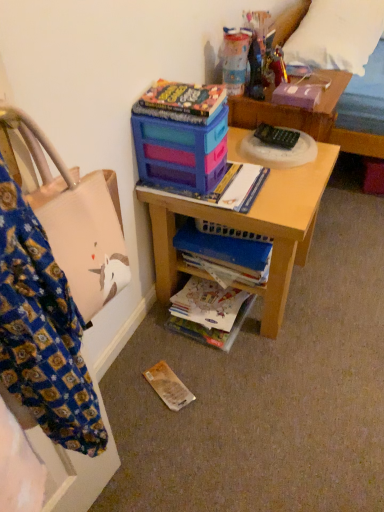
This screenshot has width=384, height=512. What are the coordinates of `free space in front of matte paper book at lower center, which is the 2th book from top to bottom` in the screenshot? It's located at (206, 371).